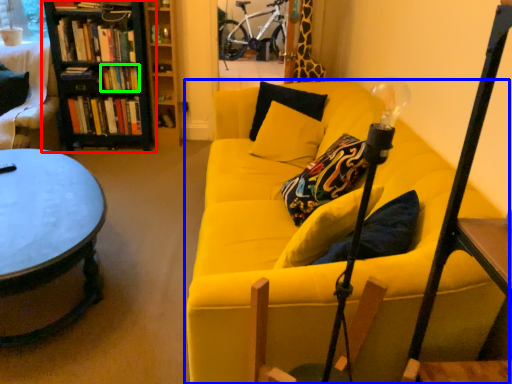
Question: Which is farther away from bookcase (highlighted by a red box)? studio couch (highlighted by a blue box) or book (highlighted by a green box)?

Choices:
 (A) studio couch
 (B) book

Answer: (A)